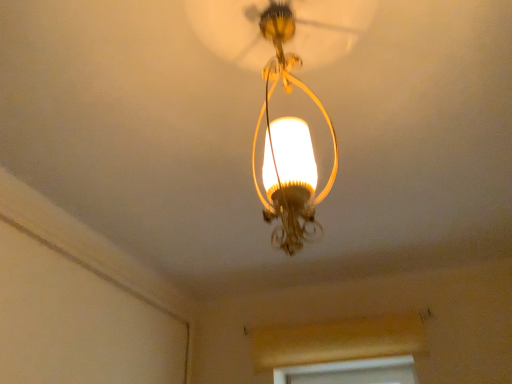
Question: Is wooden window frame at lower center to the right of matte gold chandelier at center from the viewer's perspective?

Choices:
 (A) yes
 (B) no

Answer: (A)

Question: Can we say wooden window frame at lower center lies outside matte gold chandelier at center?

Choices:
 (A) no
 (B) yes

Answer: (B)

Question: From the image's perspective, would you say wooden window frame at lower center is positioned over matte gold chandelier at center?

Choices:
 (A) no
 (B) yes

Answer: (A)

Question: Is wooden window frame at lower center oriented away from matte gold chandelier at center?

Choices:
 (A) yes
 (B) no

Answer: (B)

Question: Considering the relative sizes of wooden window frame at lower center and matte gold chandelier at center in the image provided, is wooden window frame at lower center shorter than matte gold chandelier at center?

Choices:
 (A) no
 (B) yes

Answer: (B)

Question: From a real-world perspective, does wooden window frame at lower center stand above matte gold chandelier at center?

Choices:
 (A) yes
 (B) no

Answer: (B)

Question: Does matte gold chandelier at center have a greater width compared to wooden window frame at lower center?

Choices:
 (A) yes
 (B) no

Answer: (A)

Question: Is matte gold chandelier at center surrounding wooden window frame at lower center?

Choices:
 (A) yes
 (B) no

Answer: (B)

Question: Can you confirm if matte gold chandelier at center is thinner than wooden window frame at lower center?

Choices:
 (A) no
 (B) yes

Answer: (A)

Question: Considering the relative sizes of matte gold chandelier at center and wooden window frame at lower center in the image provided, is matte gold chandelier at center taller than wooden window frame at lower center?

Choices:
 (A) no
 (B) yes

Answer: (B)

Question: From a real-world perspective, is matte gold chandelier at center below wooden window frame at lower center?

Choices:
 (A) yes
 (B) no

Answer: (B)

Question: Is the position of matte gold chandelier at center more distant than that of wooden window frame at lower center?

Choices:
 (A) yes
 (B) no

Answer: (B)

Question: Looking at the image, does matte gold chandelier at center seem bigger or smaller compared to wooden window frame at lower center?

Choices:
 (A) big
 (B) small

Answer: (A)